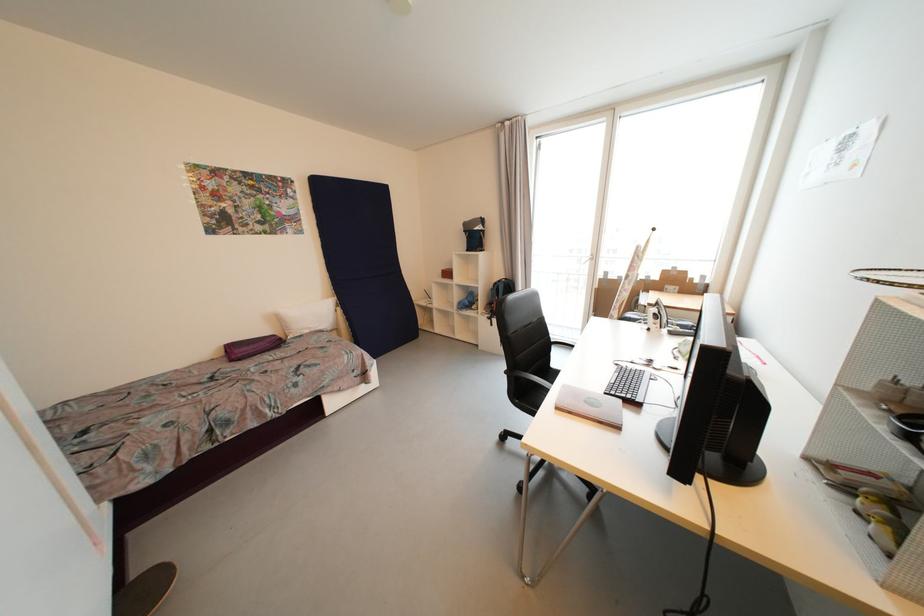
Where would you lift the white pillow? Please return your answer as a coordinate pair (x, y).

(308, 317)